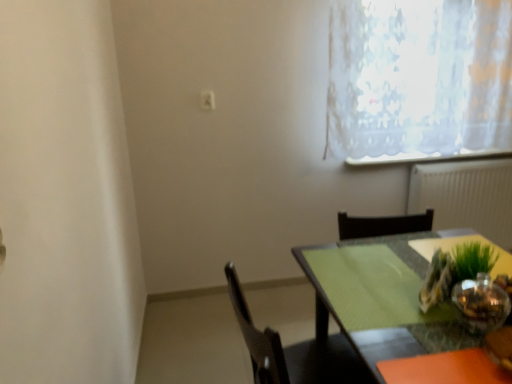
Identify the location of blank space above green glass table at center, the first chair in the top-to-bottom sequence (from a real-world perspective). This screenshot has width=512, height=384. (373, 282).